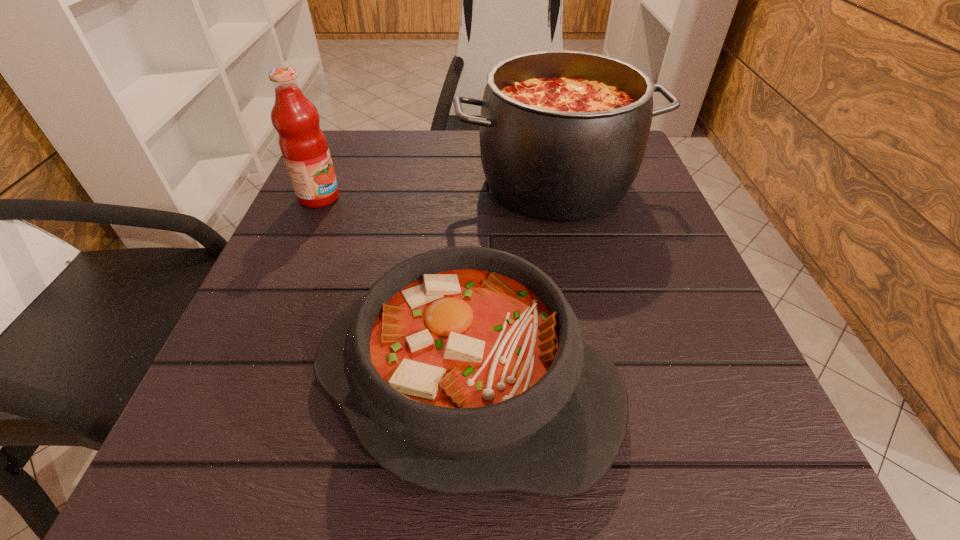
Where is `the leftmost object`? The height and width of the screenshot is (540, 960). the leftmost object is located at coordinates (303, 145).

The height and width of the screenshot is (540, 960). I want to click on the farther casserole, so click(563, 134).

Locate an element on the screen. The width and height of the screenshot is (960, 540). the nearest object is located at coordinates pyautogui.click(x=463, y=370).

Locate an element on the screen. Image resolution: width=960 pixels, height=540 pixels. the nearer casserole is located at coordinates (463, 370).

Where is `vacant position located 0.100m on the front label of the fruit juice`? vacant position located 0.100m on the front label of the fruit juice is located at coordinates (392, 197).

Locate an element on the screen. Image resolution: width=960 pixels, height=540 pixels. vacant space located 0.360m on the front of the farther casserole is located at coordinates (606, 420).

Locate an element on the screen. This screenshot has height=540, width=960. free space located 0.230m on the back of the nearest object is located at coordinates (470, 207).

You are a GUI agent. You are given a task and a screenshot of the screen. Output one action in this format:
    pyautogui.click(x=<x>, y=<y>)
    Task: Click on the fruit juice located at the far edge
    The height and width of the screenshot is (540, 960).
    Given the screenshot: What is the action you would take?
    pyautogui.click(x=303, y=145)

Locate an element on the screen. The height and width of the screenshot is (540, 960). casserole at the far edge is located at coordinates (563, 134).

Image resolution: width=960 pixels, height=540 pixels. Identify the location of object at the near edge. pyautogui.click(x=463, y=370).